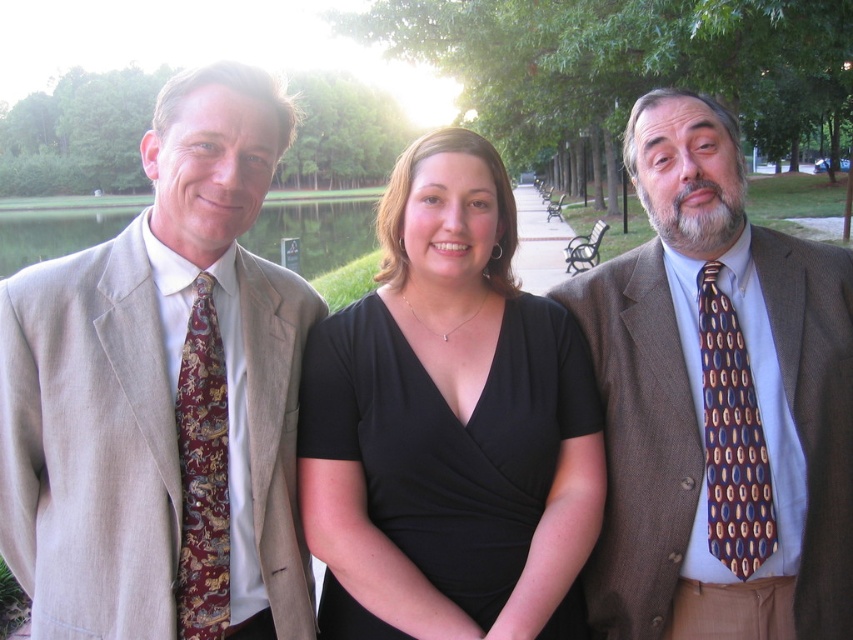
You are taking a photo of the three people in the park. The two points you are focusing on are point (207,524) and point (567,260). Which point should you focus on to ensure the person closer to the camera is in sharp focus?

You should focus on point (207,524) because it is closer to the camera than point (567,260).

You are a photographer setting up a tripod to take a group photo of the light beige suit at left and brown textured suit at right. Since you want both subjects to be framed properly, which suit should you adjust the camera angle upwards to focus on?

You should adjust the camera angle upwards to focus on the brown textured suit at right because it is taller than the light beige suit at left.

Consider the image. In the scene, there are three people standing in a park with a calm body of water in the background. The left person is wearing a beige suit jacket with a red and gold patterned tie, the center person has a black wrap dress, and the right person is wearing a burgundy silk tie. Where exactly is the point located at coordinates (202, 474)?

The point at coordinates (202, 474) is located on the burgundy silk tie at left.